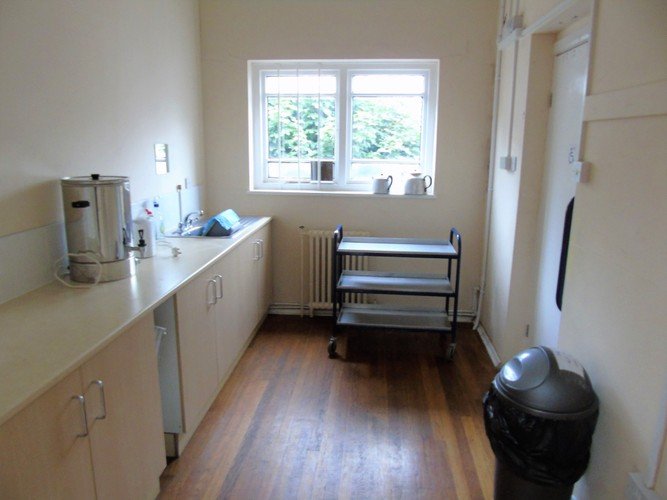
You are a GUI agent. You are given a task and a screenshot of the screen. Output one action in this format:
    pyautogui.click(x=<x>, y=<y>)
    Task: Click on the cabinet
    Image resolution: width=667 pixels, height=500 pixels.
    Given the screenshot: What is the action you would take?
    pyautogui.click(x=63, y=449), pyautogui.click(x=143, y=423), pyautogui.click(x=197, y=356), pyautogui.click(x=233, y=324), pyautogui.click(x=245, y=286), pyautogui.click(x=267, y=267)